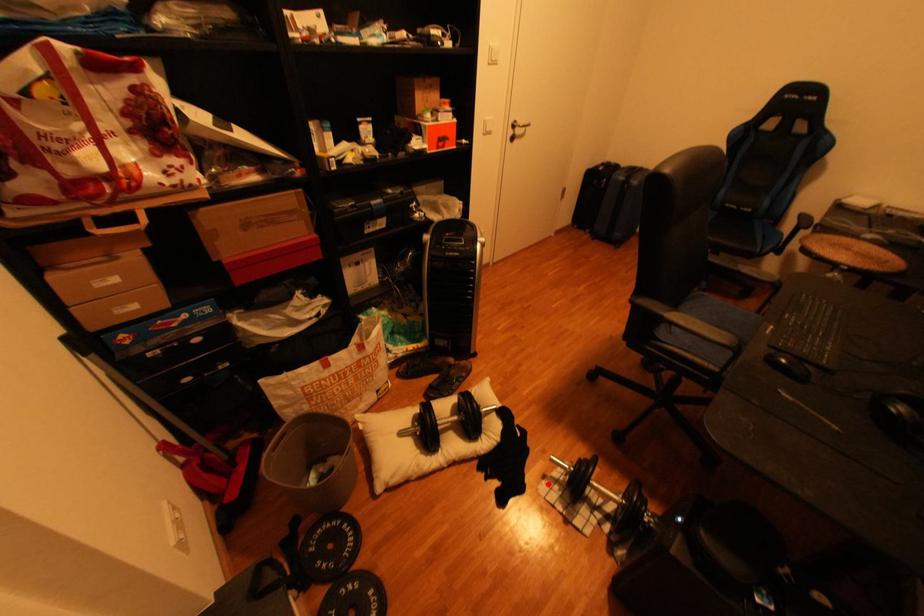
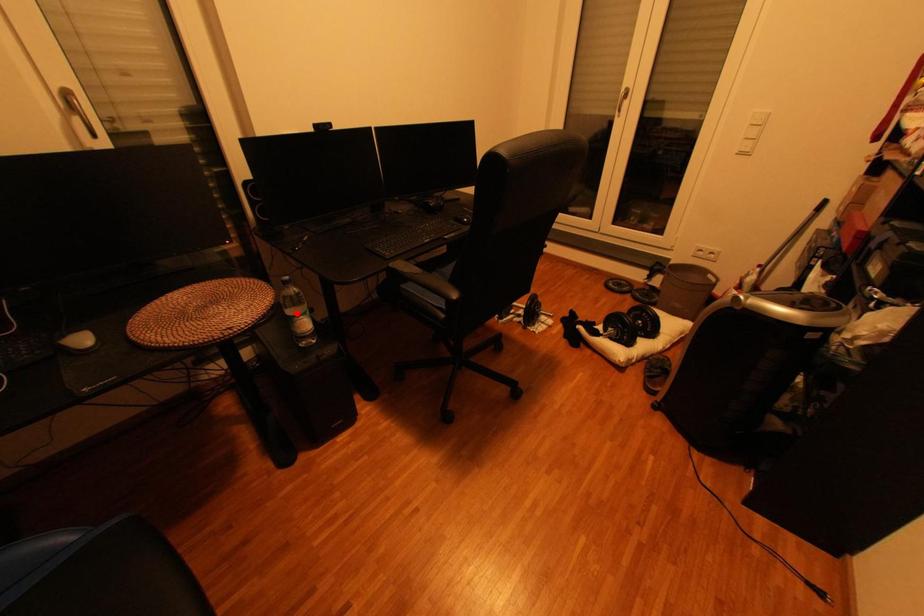
I am providing you with two images of the same scene from different viewpoints. A red point is marked on the first image and another point is marked on the second image. Is the marked point in image1 the same physical position as the marked point in image2?

No